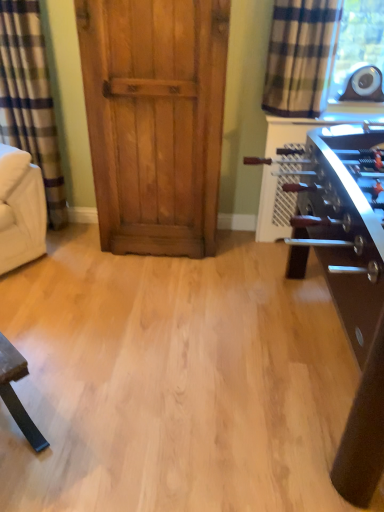
Locate an element on the screen. This screenshot has height=512, width=384. vacant space to the right of wooden door at center is located at coordinates (242, 249).